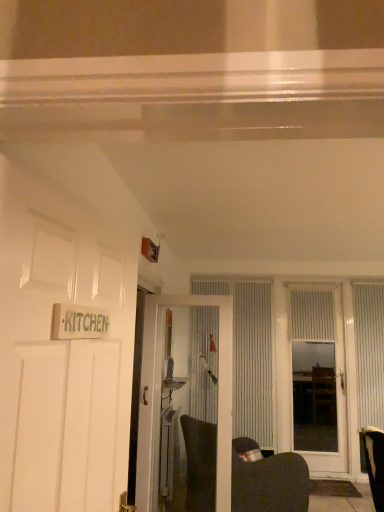
Question: Is white textured door at center, the 2th door viewed from the right, positioned behind white textured door at center, which is counted as the 1th door, starting from the back?

Choices:
 (A) no
 (B) yes

Answer: (A)

Question: From a real-world perspective, is white textured door at center, which is the second door in left-to-right order, positioned over white textured door at center, which is counted as the 1th door, starting from the back, based on gravity?

Choices:
 (A) yes
 (B) no

Answer: (B)

Question: Would you consider white textured door at center, the second door viewed from the front, to be distant from white textured door at center, which is the 3th door in left-to-right order?

Choices:
 (A) no
 (B) yes

Answer: (B)

Question: Is white textured door at center, the second door viewed from the back, directly adjacent to white textured door at center, which is counted as the 1th door, starting from the back?

Choices:
 (A) no
 (B) yes

Answer: (A)

Question: From the image's perspective, is white textured door at center, the 2th door viewed from the right, on top of white textured door at center, which is counted as the 1th door, starting from the back?

Choices:
 (A) no
 (B) yes

Answer: (B)

Question: From a real-world perspective, relative to dark gray fabric swivel chair at lower center, is white glossy door at left, the 3th door viewed from the back, vertically above or below?

Choices:
 (A) above
 (B) below

Answer: (A)

Question: Looking at their shapes, would you say white glossy door at left, the 3th door viewed from the back, is wider or thinner than dark gray fabric swivel chair at lower center?

Choices:
 (A) thin
 (B) wide

Answer: (A)

Question: Considering the positions of white glossy door at left, the 3th door viewed from the back, and dark gray fabric swivel chair at lower center in the image, is white glossy door at left, the 3th door viewed from the back, taller or shorter than dark gray fabric swivel chair at lower center?

Choices:
 (A) tall
 (B) short

Answer: (A)

Question: Which is correct: white glossy door at left, the first door when ordered from left to right, is inside dark gray fabric swivel chair at lower center, or outside of it?

Choices:
 (A) inside
 (B) outside

Answer: (B)

Question: Relative to white textured door at center, which is the second door in left-to-right order, is white textured curtain at center, the first curtain in the left-to-right sequence, in front or behind?

Choices:
 (A) behind
 (B) front

Answer: (A)

Question: From a real-world perspective, is white textured curtain at center, which ranks as the third curtain in right-to-left order, above or below white textured door at center, the second door viewed from the front?

Choices:
 (A) above
 (B) below

Answer: (A)

Question: Considering the positions of point (x=243, y=368) and point (x=145, y=438), is point (x=243, y=368) closer or farther from the camera than point (x=145, y=438)?

Choices:
 (A) closer
 (B) farther

Answer: (B)

Question: Would you say white textured curtain at center, the first curtain in the left-to-right sequence, is to the left or to the right of white textured door at center, the 2th door viewed from the right, in the picture?

Choices:
 (A) right
 (B) left

Answer: (A)

Question: In the image, is white textured curtain at right, the first curtain in the right-to-left sequence, positioned in front of or behind white glossy door at left, which is the third door in right-to-left order?

Choices:
 (A) behind
 (B) front

Answer: (A)

Question: Based on their sizes in the image, would you say white textured curtain at right, the first curtain in the right-to-left sequence, is bigger or smaller than white glossy door at left, the 1th door viewed from the front?

Choices:
 (A) small
 (B) big

Answer: (A)